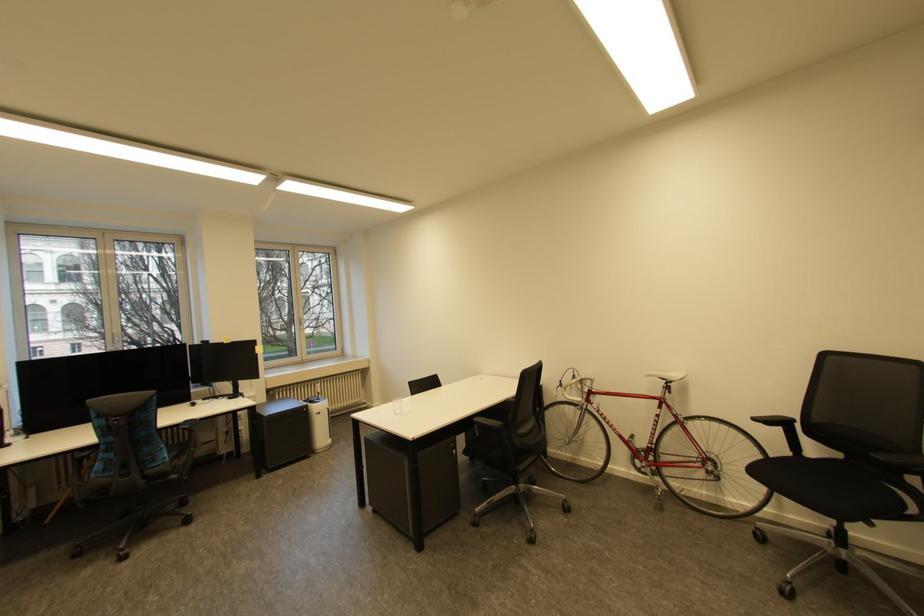
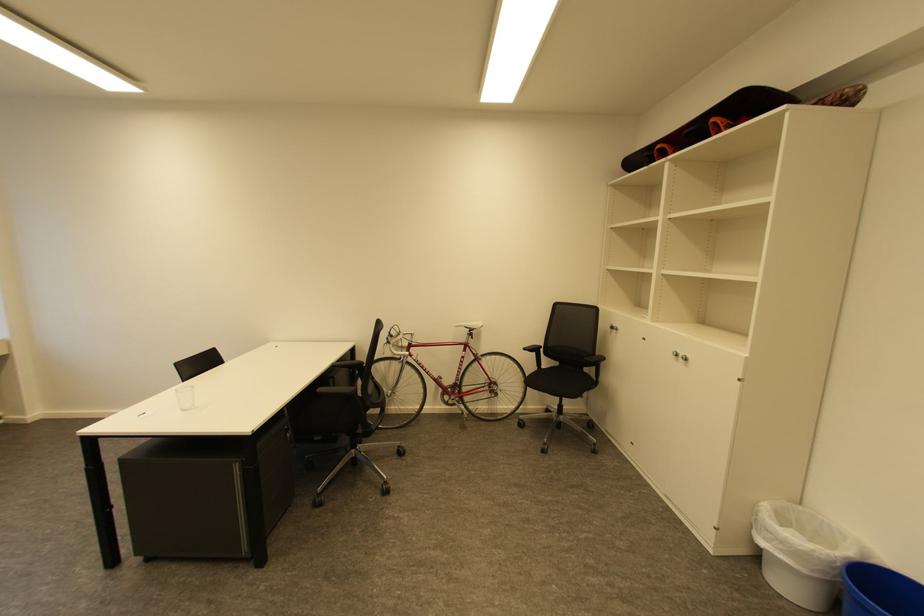
Find the pixel in the second image that matches pixel 881 456 in the first image.

(591, 360)